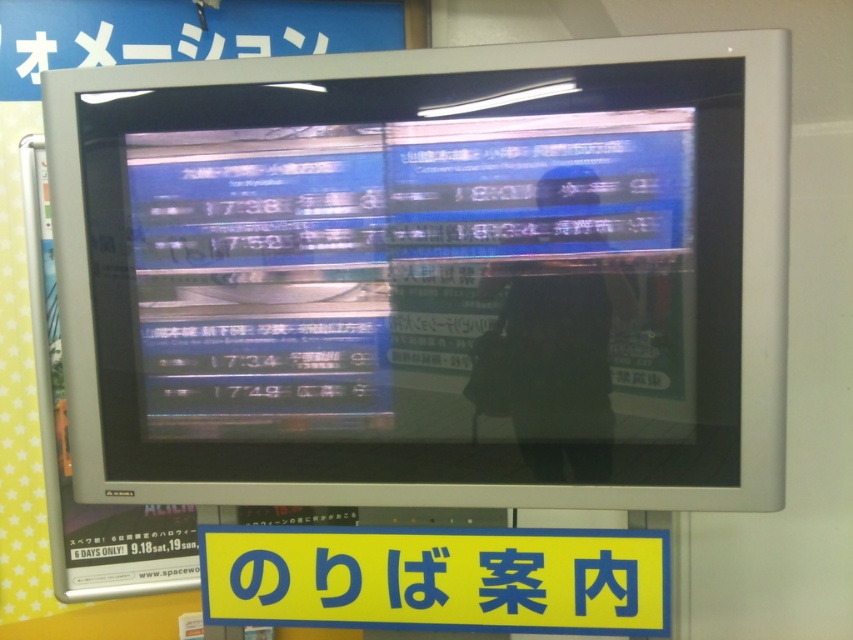
Question: Is yellow matte sign at center further to camera compared to dark gray fabric man at center?

Choices:
 (A) yes
 (B) no

Answer: (A)

Question: Among these points, which one is nearest to the camera?

Choices:
 (A) (599, 401)
 (B) (254, 566)

Answer: (A)

Question: Which point appears closest to the camera in this image?

Choices:
 (A) (642, 620)
 (B) (490, 342)

Answer: (B)

Question: Does yellow matte sign at center appear on the left side of dark gray fabric man at center?

Choices:
 (A) yes
 (B) no

Answer: (A)

Question: Which object is farther from the camera taking this photo?

Choices:
 (A) dark gray fabric man at center
 (B) yellow matte sign at center

Answer: (B)

Question: From the image, what is the correct spatial relationship of yellow matte sign at center in relation to dark gray fabric man at center?

Choices:
 (A) below
 (B) above

Answer: (A)